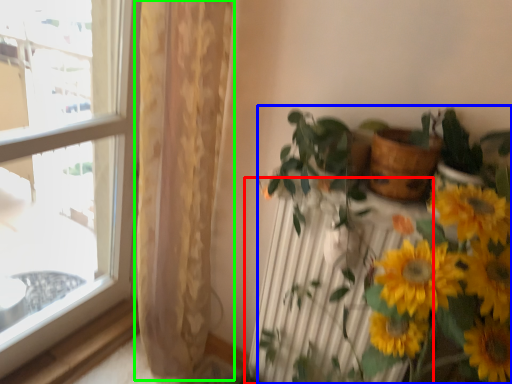
Question: Which object is positioned closest to radiator (highlighted by a red box)? Select from houseplant (highlighted by a blue box) and curtain (highlighted by a green box).

Choices:
 (A) houseplant
 (B) curtain

Answer: (A)